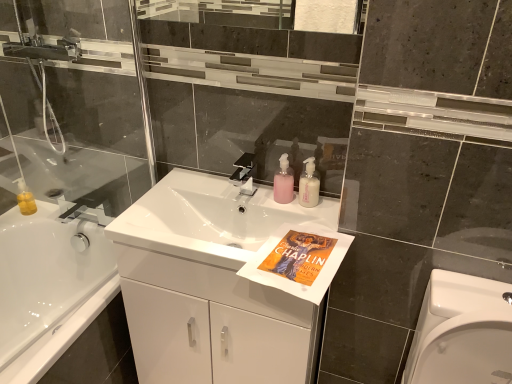
Where is `empty space that is to the right of satin nickel faucet at center`? empty space that is to the right of satin nickel faucet at center is located at coordinates (284, 205).